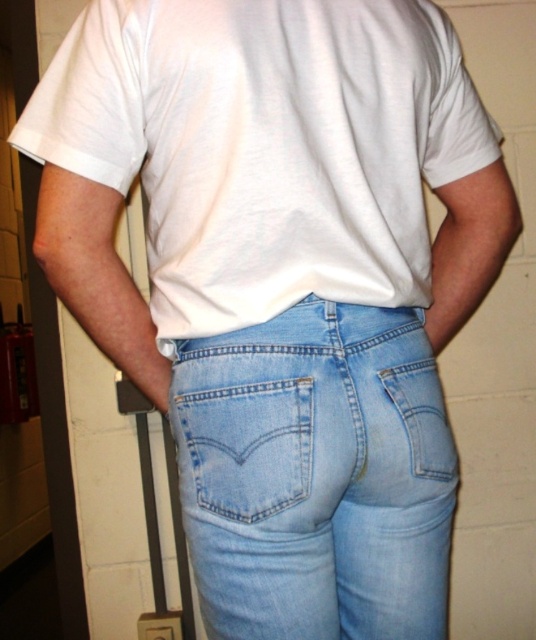
You are a fashion designer analyzing the placement of pockets on a pair of jeans. You notice two light blue denim pockets on the jeans. Which one is positioned lower between the light blue denim pocket at center and the light blue denim pocket at lower center?

The light blue denim pocket at lower center is positioned lower than the light blue denim pocket at center.

You are an interior designer assessing the placement of items in a room. You notice the light blue denim jeans at center and the light blue denim pocket at lower center. Which object is positioned closer to you?

The light blue denim jeans at center is closer to the viewer than the light blue denim pocket at lower center.